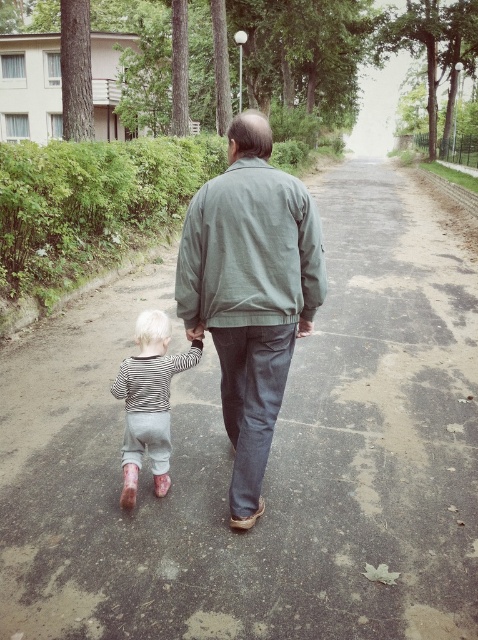
You are a photographer trying to capture a photo of the gray cotton jacket at center and the striped cotton shirt at lower left. Based on their positions, which one should you focus on first to ensure both are in frame?

The gray cotton jacket at center is above the striped cotton shirt at lower left, so you should focus on the gray cotton jacket at center first to ensure both are in frame.

You are a photographer trying to capture both the gray cotton jacket at center and the striped cotton shirt at lower left in a single frame. Given their sizes, which one will appear larger in the photo?

The gray cotton jacket at center will appear larger in the photo because it is bigger than the striped cotton shirt at lower left.